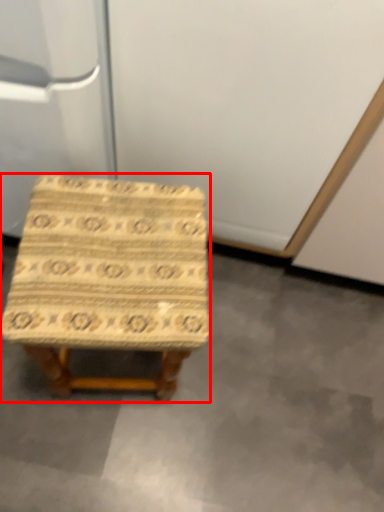
Question: Considering the relative positions of stool (annotated by the red box) and concrete in the image provided, where is stool (annotated by the red box) located with respect to the staircase?

Choices:
 (A) left
 (B) right

Answer: (A)